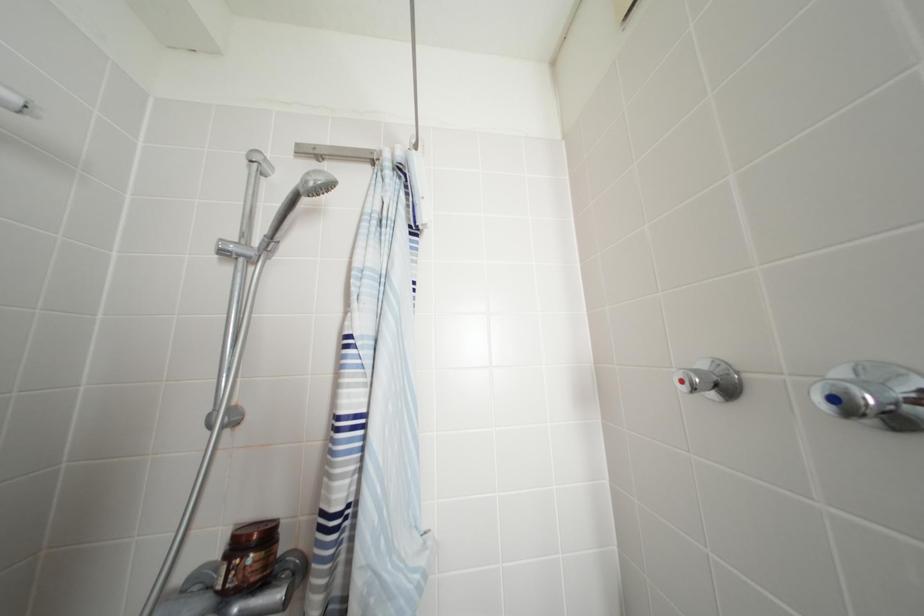
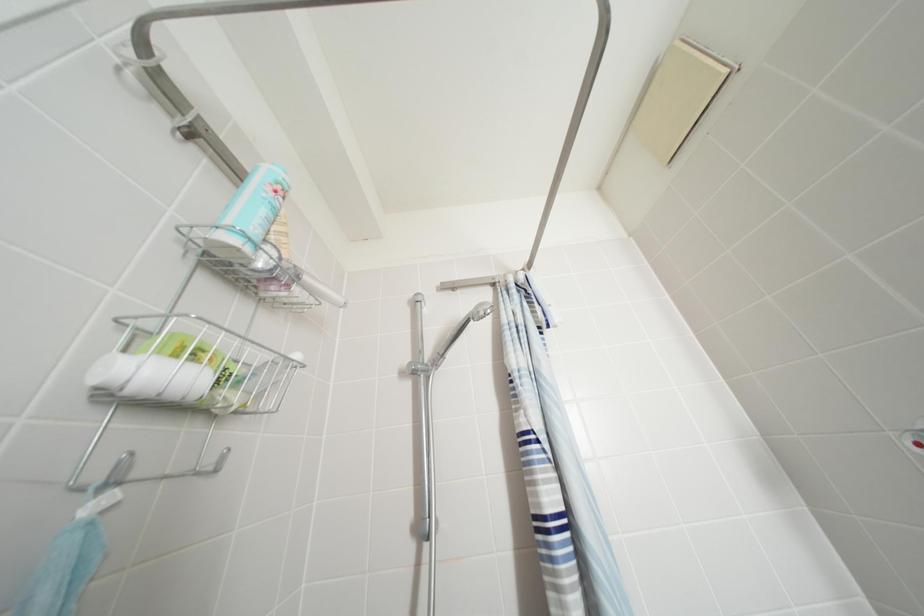
Question: The first image is from the beginning of the video and the second image is from the end. How did the camera likely rotate when shooting the video?

Choices:
 (A) Left
 (B) Right
 (C) Up
 (D) Down

Answer: (C)